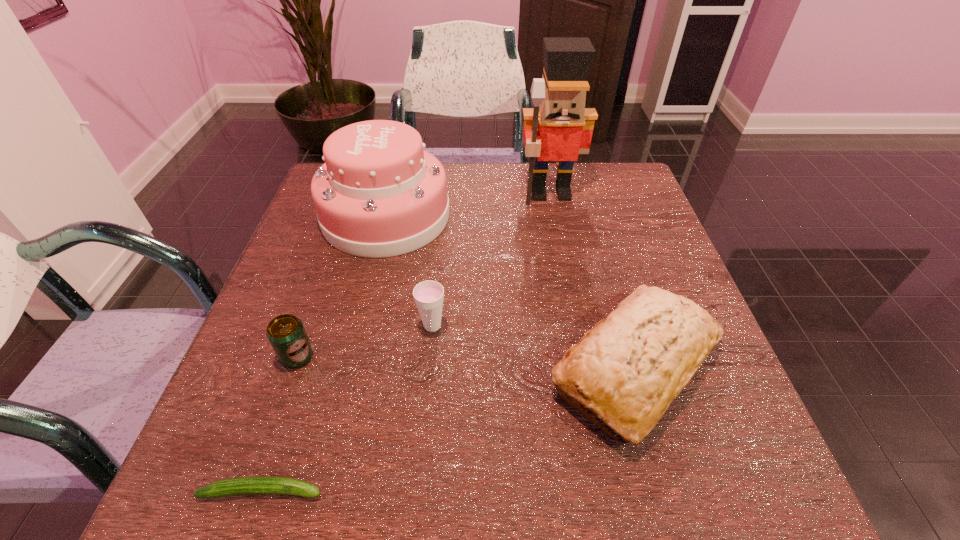
Image resolution: width=960 pixels, height=540 pixels. Identify the location of nutcracker. (559, 127).

This screenshot has width=960, height=540. I want to click on cake, so click(379, 194).

Identify the location of the fourth shortest object. The image size is (960, 540). (x=629, y=368).

Image resolution: width=960 pixels, height=540 pixels. I want to click on cup, so click(428, 295).

Where is `beer can`? The width and height of the screenshot is (960, 540). beer can is located at coordinates (286, 333).

Find the location of `the shortest object`. the shortest object is located at coordinates (242, 485).

Locate an element on the screen. the nearest object is located at coordinates (242, 485).

You are a GUI agent. You are given a task and a screenshot of the screen. Output one action in this format:
    pyautogui.click(x=<x>, y=<y>)
    Task: Click on the blank space located 0.270m in front of the nutcracker holding the staff
    The width and height of the screenshot is (960, 540).
    Given the screenshot: What is the action you would take?
    pyautogui.click(x=568, y=282)

At what (x,y) coordinates should I click in order to perform the action: click on vacant space situated on the right of the fifth shortest object. Please return your answer as a coordinate pair (x, y). This screenshot has height=540, width=960. Looking at the image, I should click on (599, 216).

Find the location of a particular element. This screenshot has height=540, width=960. vacant space located 0.360m on the back of the third tallest object is located at coordinates (587, 202).